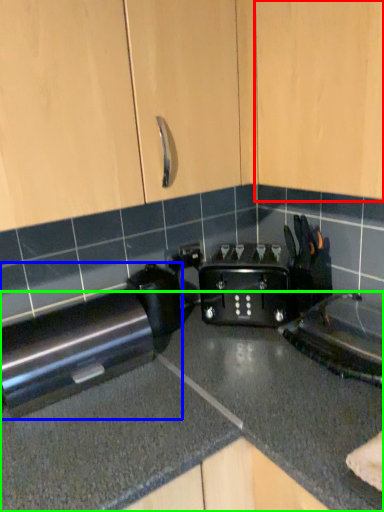
Question: Which object is the farthest from cabinetry (highlighted by a red box)? Choose among these: home appliance (highlighted by a blue box) or countertop (highlighted by a green box).

Choices:
 (A) home appliance
 (B) countertop

Answer: (A)